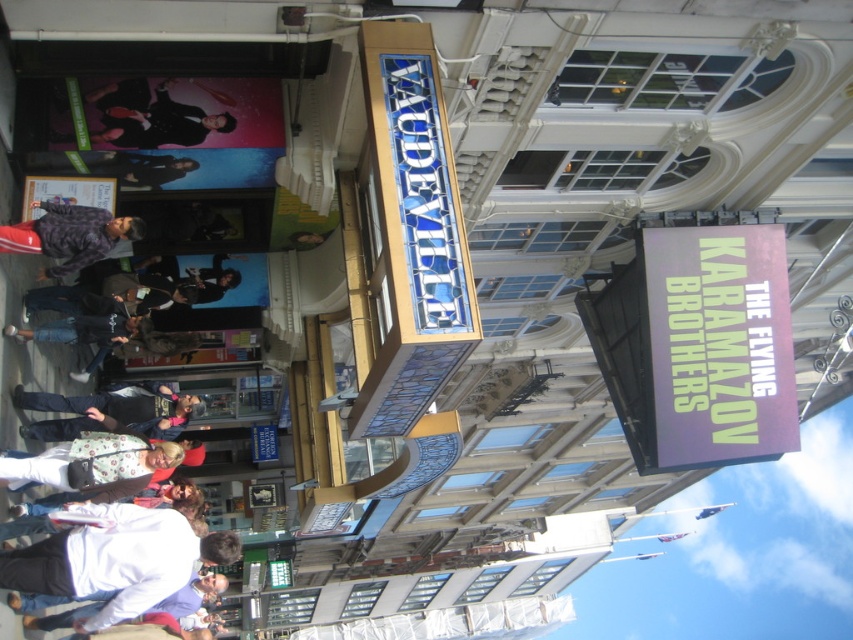
Question: Which point is farther to the camera?

Choices:
 (A) (9, 216)
 (B) (111, 144)
 (C) (38, 220)

Answer: (A)

Question: Is shiny black suit at upper left smaller than plaid fabric shirt at lower left?

Choices:
 (A) no
 (B) yes

Answer: (B)

Question: Where is floral-patterned fabric at lower left located in relation to floral fabric jacket at lower center in the image?

Choices:
 (A) below
 (B) above

Answer: (B)

Question: Estimate the real-world distances between objects in this image. Which object is farther from the plaid fabric shirt at lower left?

Choices:
 (A) floral fabric jacket at lower center
 (B) floral-patterned fabric at lower left
 (C) white matte shirt at lower left
 (D) shiny black suit at upper left

Answer: (C)

Question: Which of the following is the closest to the observer?

Choices:
 (A) [x=28, y=237]
 (B) [x=196, y=115]
 (C) [x=49, y=369]

Answer: (A)

Question: Is floral-patterned fabric at lower left wider than floral fabric jacket at lower center?

Choices:
 (A) no
 (B) yes

Answer: (B)